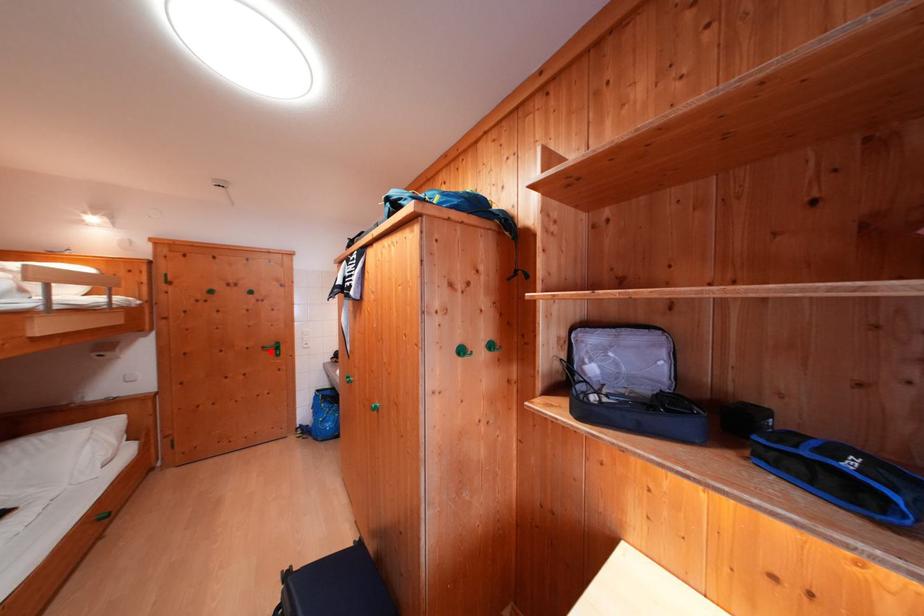
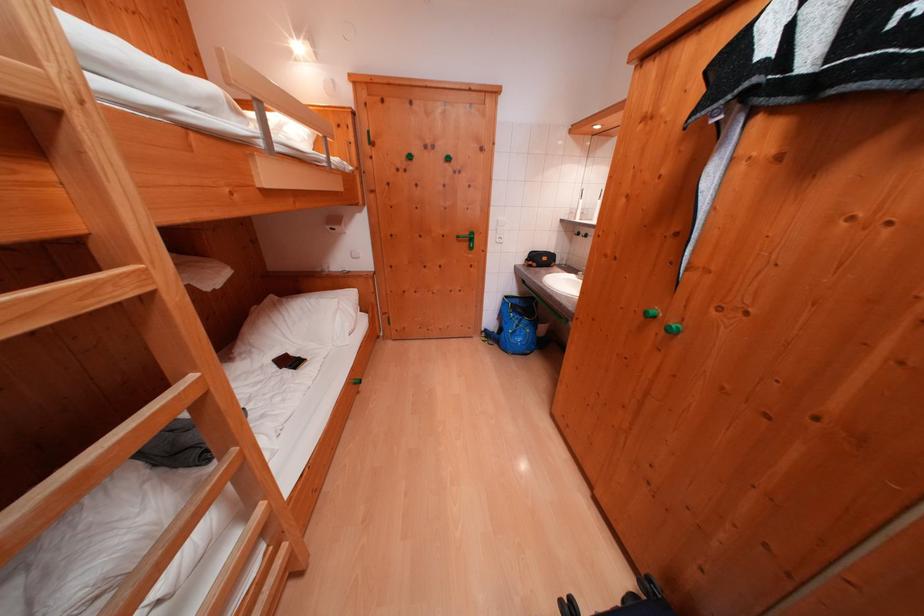
Question: I am providing you with two images of the same scene from different viewpoints. Image1 has a red point marked. In image2, the corresponding 3D location appears at what relative position? Reply with the corresponding letter.

Choices:
 (A) Closer
 (B) Farther

Answer: (A)